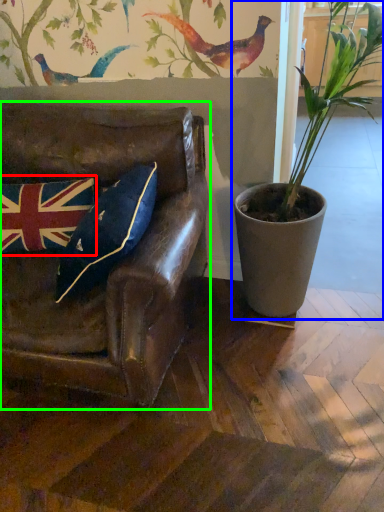
Question: Estimate the real-world distances between objects in this image. Which object is closer to flag (highlighted by a red box), houseplant (highlighted by a blue box) or chair (highlighted by a green box)?

Choices:
 (A) houseplant
 (B) chair

Answer: (B)